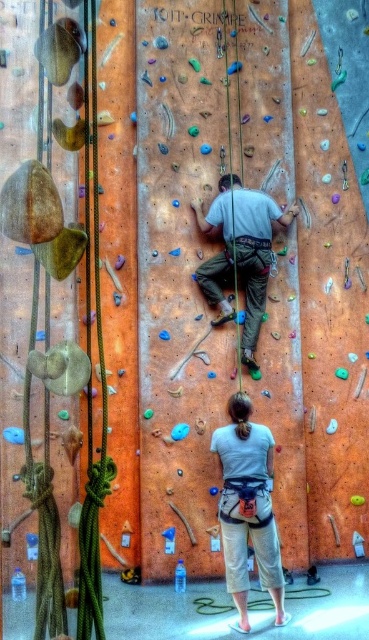
Who is more distant from viewer, (243, 476) or (230, 182)?

Positioned behind is point (230, 182).

Does point (266, 476) lie behind point (252, 340)?

No, it is not.

Identify the location of light beige pants at lower center. The height and width of the screenshot is (640, 369). (247, 508).